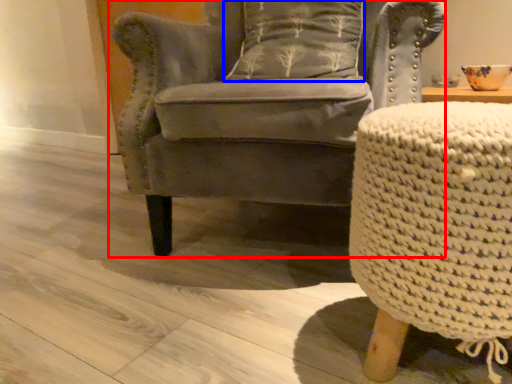
Question: Which of the following is the farthest to the observer, chair (highlighted by a red box) or pillow (highlighted by a blue box)?

Choices:
 (A) chair
 (B) pillow

Answer: (B)